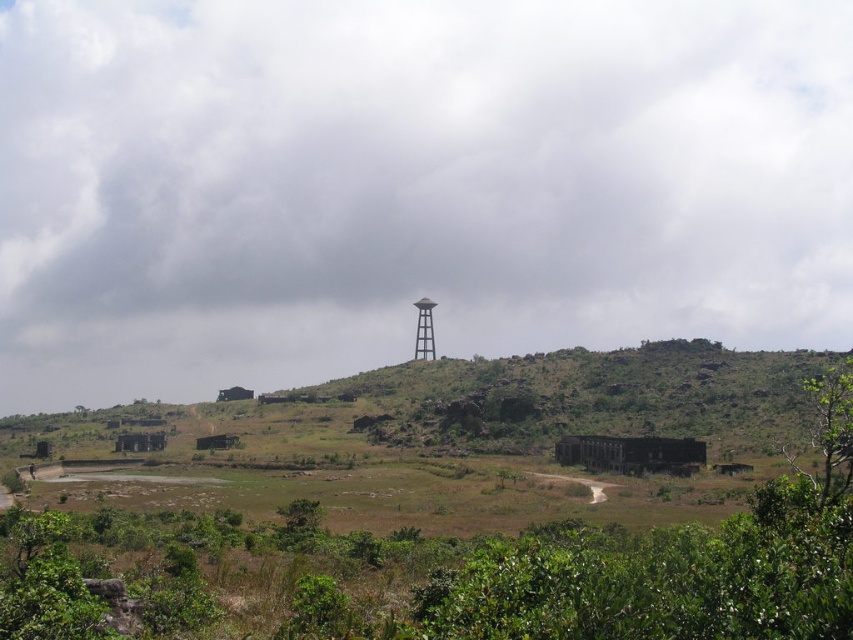
Can you confirm if green leafy tree at lower left is bigger than metallic gray observation tower at center?

No, green leafy tree at lower left is not bigger than metallic gray observation tower at center.

Is green leafy tree at lower left above metallic gray observation tower at center?

Actually, green leafy tree at lower left is below metallic gray observation tower at center.

Is point (282, 508) positioned before point (432, 356)?

Yes, it is in front of point (432, 356).

The image size is (853, 640). Find the location of `green leafy tree at lower left`. green leafy tree at lower left is located at coordinates (299, 524).

Which is behind, point (851, 458) or point (421, 316)?

Point (421, 316)

How distant is green leafy tree at lower right from metallic gray observation tower at center?

505.26 feet

Between point (848, 435) and point (428, 356), which one is positioned in front?

Point (848, 435) is more forward.

Where is `green leafy tree at lower right`? Image resolution: width=853 pixels, height=640 pixels. green leafy tree at lower right is located at coordinates (828, 433).

Is green leafy tree at lower right to the right of green leafy tree at lower left from the viewer's perspective?

Indeed, green leafy tree at lower right is positioned on the right side of green leafy tree at lower left.

Is point (837, 387) positioned before point (316, 515)?

Yes, it is in front of point (316, 515).

Describe the element at coordinates (828, 433) in the screenshot. I see `green leafy tree at lower right` at that location.

Identify the location of green leafy tree at lower right. (828, 433).